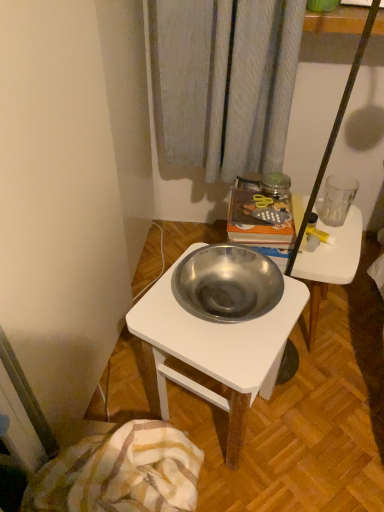
What are the coordinates of `vacant region in front of transparent glass at right` in the screenshot? It's located at (334, 248).